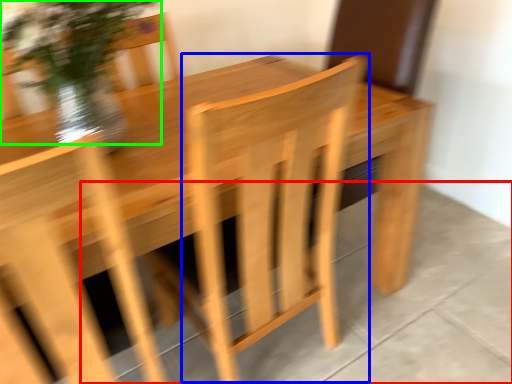
Question: Which is nearer to the concrete (highlighted by a red box)? armchair (highlighted by a blue box) or floral arrangement (highlighted by a green box).

Choices:
 (A) armchair
 (B) floral arrangement

Answer: (A)